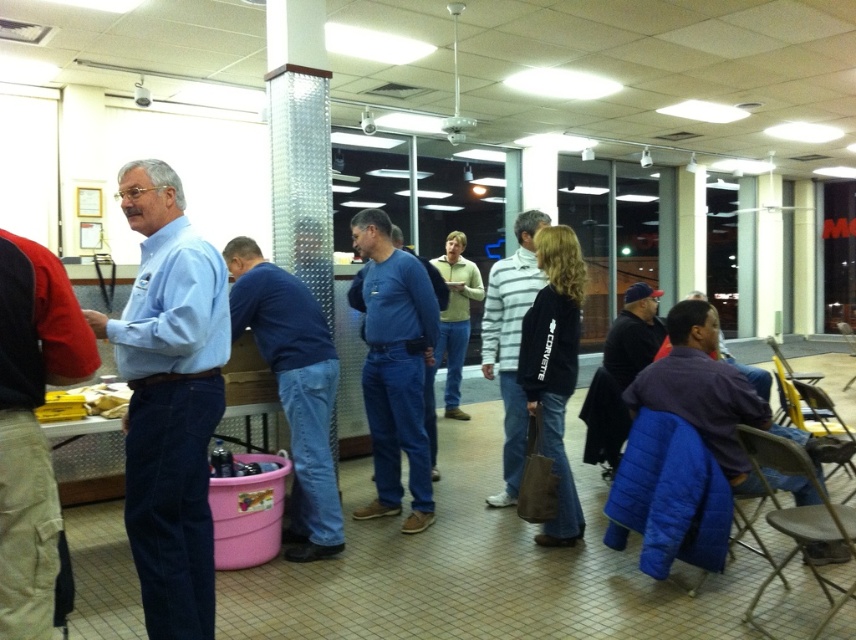
Question: Among these objects, which one is farthest from the camera?

Choices:
 (A) blue denim jeans at center
 (B) light blue shirt at center
 (C) light blue shirt at left

Answer: (A)

Question: Does striped cotton shirt at center appear under purple cotton shirt at lower right?

Choices:
 (A) yes
 (B) no

Answer: (B)

Question: Which object is farther from the camera taking this photo?

Choices:
 (A) blue jeans at center
 (B) blue denim jeans at center
 (C) purple cotton shirt at lower right

Answer: (C)

Question: Which of the following is the farthest from the observer?

Choices:
 (A) striped cotton shirt at center
 (B) purple cotton shirt at lower right
 (C) dark blue cap at center
 (D) blue denim jeans at center

Answer: (C)

Question: Does light blue shirt at left appear under striped cotton shirt at center?

Choices:
 (A) no
 (B) yes

Answer: (B)

Question: Does light blue shirt at center have a lesser width compared to blue jeans at center?

Choices:
 (A) no
 (B) yes

Answer: (B)